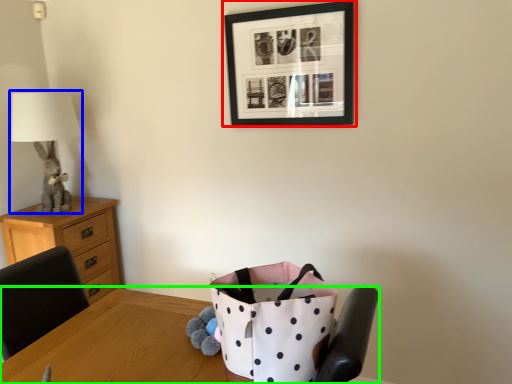
Question: Which object is the closest to the picture frame (highlighted by a red box)? Choose among these: table lamp (highlighted by a blue box) or table (highlighted by a green box).

Choices:
 (A) table lamp
 (B) table

Answer: (A)